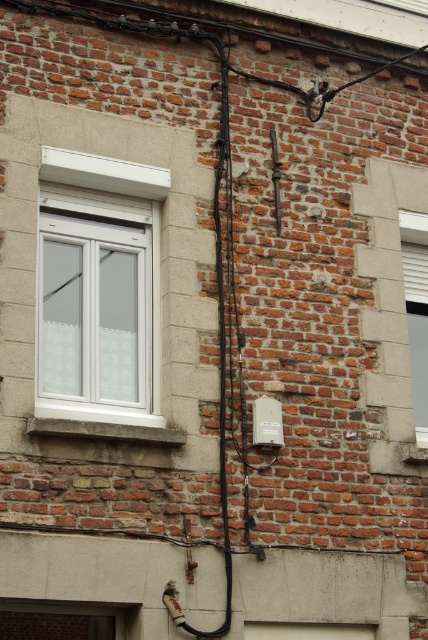
You are standing in front of a brick wall and see two windows. The first is the white plastic window at upper left, and the second is the white textured window at right. Which window is taller?

The white plastic window at upper left is taller than the white textured window at right.

You are a window installer assessing the brick wall. You need to replace the white plastic window at upper left and the white textured window at right. Which window should you replace first if you want to start from the lower part of the wall?

You should replace the white textured window at right first because it is located below the white plastic window at upper left, so starting from the lower part of the wall would mean addressing the white textured window at right before the upper one.

You are standing in front of a brick wall with two windows. You see the white plastic window at upper left and the white textured window at right. Which window is positioned more to the left side of the wall?

The white plastic window at upper left is positioned more to the left side of the wall than the white textured window at right.